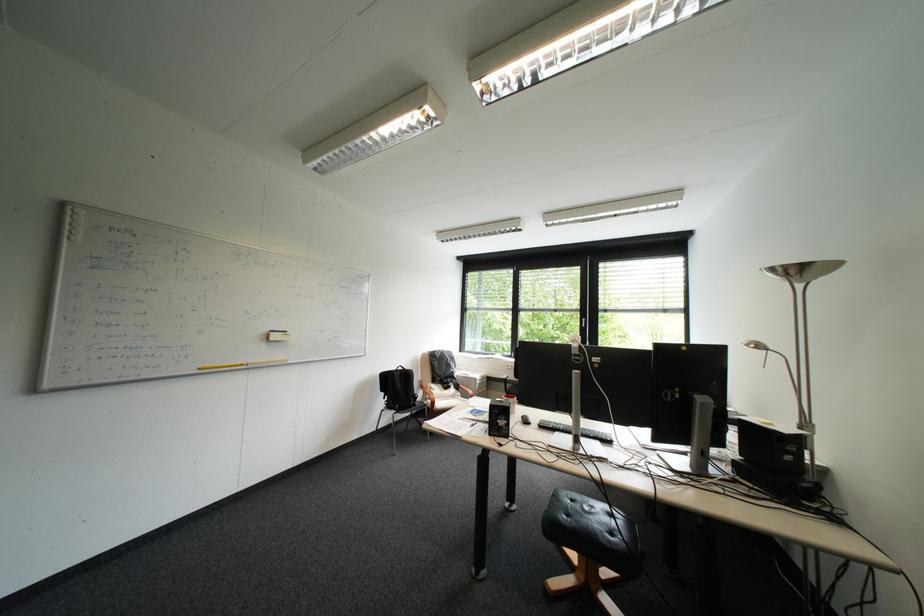
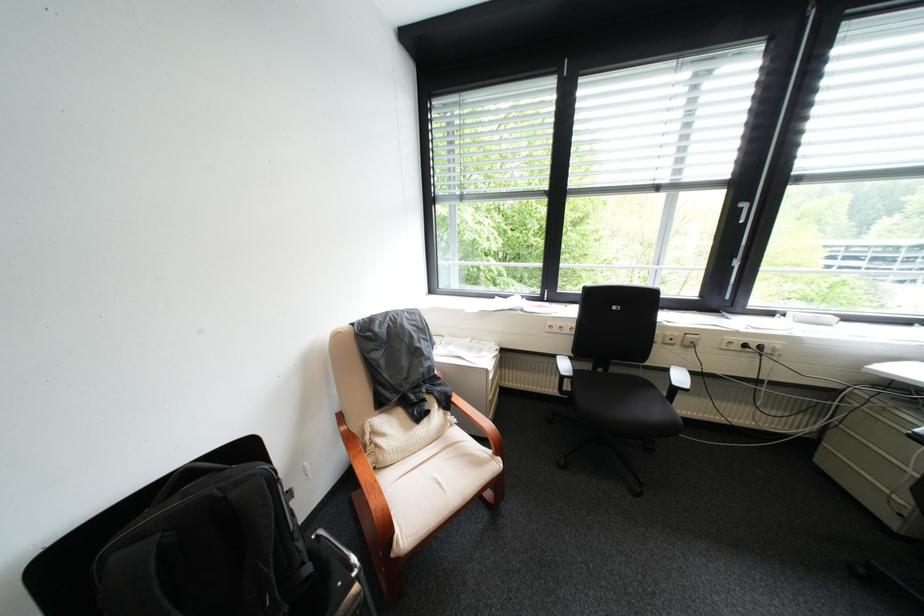
Question: In a continuous first-person perspective shot, in which direction is the camera moving?

Choices:
 (A) Left
 (B) Right
 (C) Forward
 (D) Backward

Answer: (C)